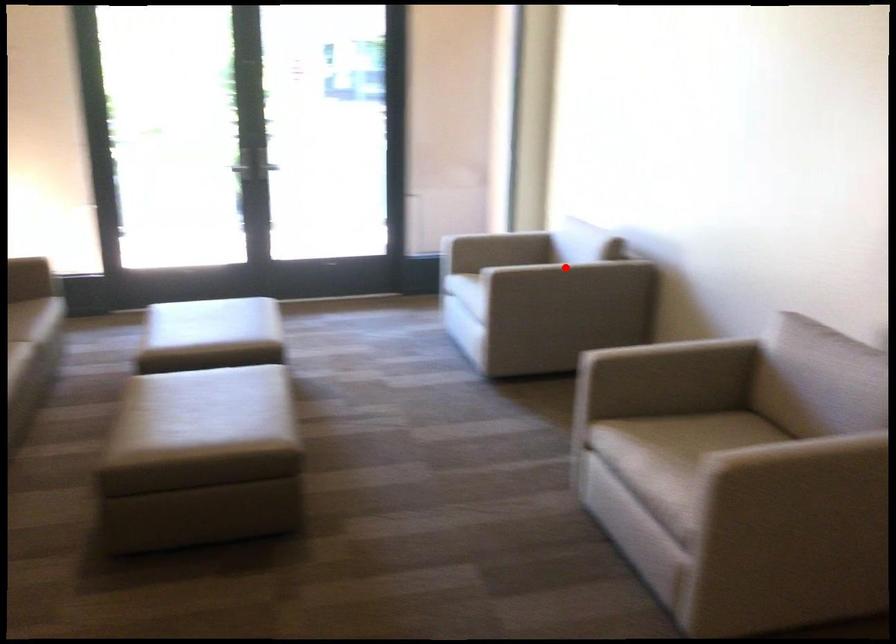
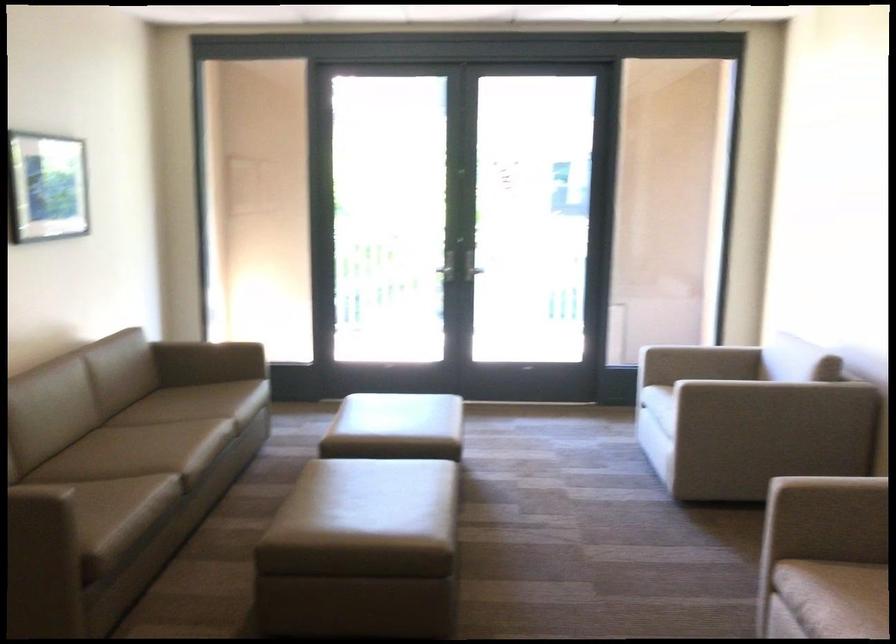
Where in the second image is the point corresponding to the highlighted location from the first image?

(774, 392)